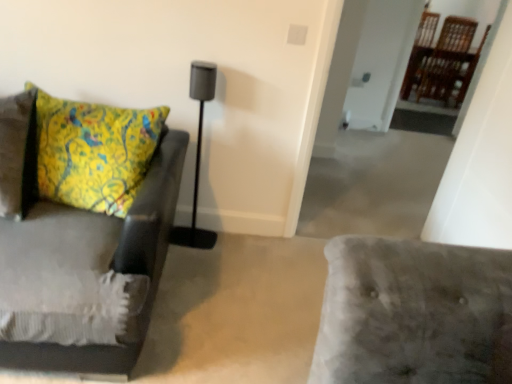
Question: In terms of size, does velvet gray couch at left appear bigger or smaller than matte black speaker at center?

Choices:
 (A) small
 (B) big

Answer: (B)

Question: From a real-world perspective, is velvet gray couch at left positioned above or below matte black speaker at center?

Choices:
 (A) above
 (B) below

Answer: (B)

Question: Visually, is velvet gray couch at left positioned to the left or to the right of matte black speaker at center?

Choices:
 (A) left
 (B) right

Answer: (A)

Question: Considering the positions of matte black speaker at center and velvet gray couch at left in the image, is matte black speaker at center wider or thinner than velvet gray couch at left?

Choices:
 (A) wide
 (B) thin

Answer: (B)

Question: From the image's perspective, is matte black speaker at center positioned above or below velvet gray couch at left?

Choices:
 (A) above
 (B) below

Answer: (A)

Question: In the image, is matte black speaker at center on the left side or the right side of velvet gray couch at left?

Choices:
 (A) right
 (B) left

Answer: (A)

Question: Is matte black speaker at center bigger or smaller than velvet gray couch at left?

Choices:
 (A) small
 (B) big

Answer: (A)